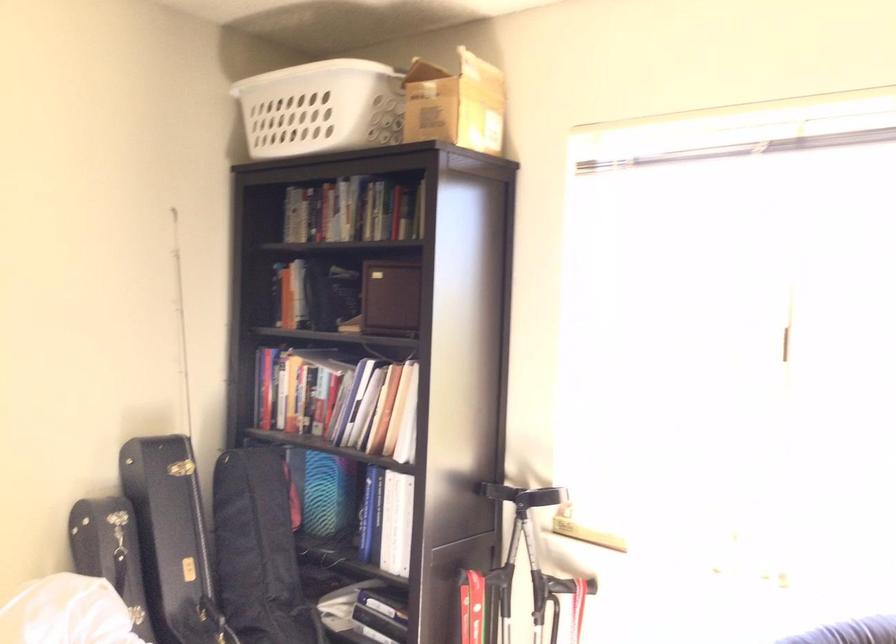
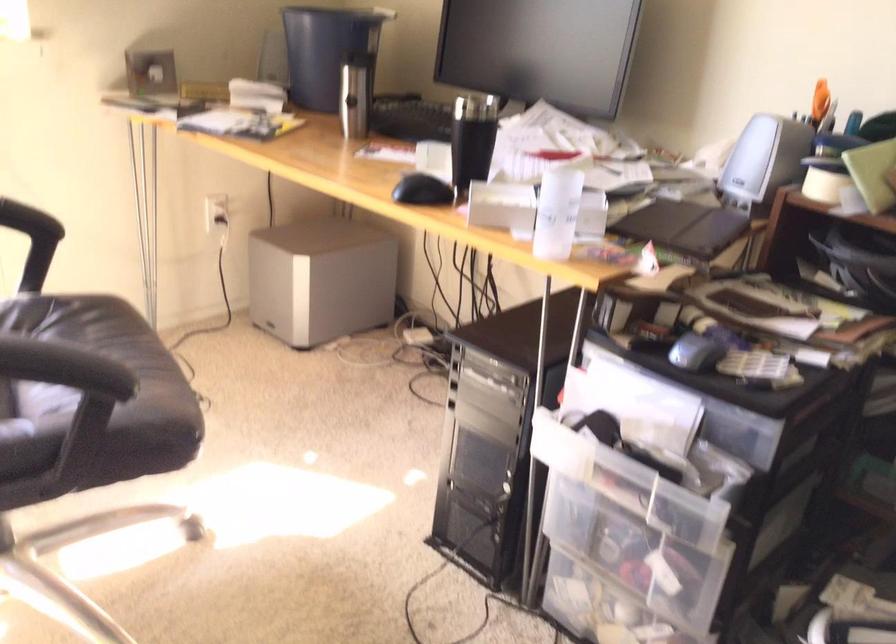
The first image is from the beginning of the video and the second image is from the end. How did the camera likely rotate when shooting the video?

The rotation direction of the camera is right-down.